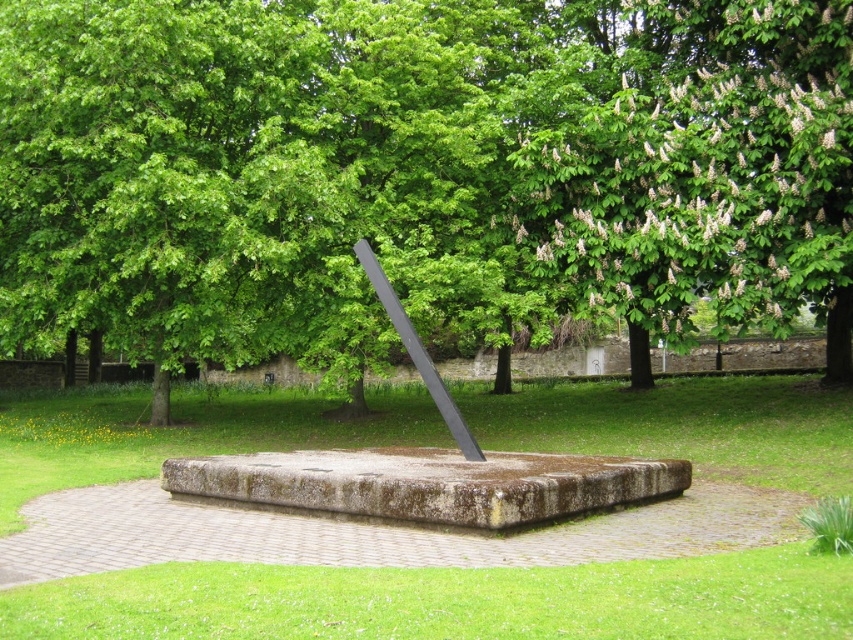
You are a landscape architect assessing the visibility of the black polished metal rod at center from the curved brick pathway. Considering the green leafy tree at center, will the tree block the view of the rod from the pathway?

The black polished metal rod at center is behind the green leafy tree at center, so the tree will block the view of the rod from the pathway.

You are a landscape architect planning to install a new bench in the park. You want to place it where it can be seen from both the green leafy tree at center and the green leafy tree at upper right. Based on their heights, which tree would provide a better vantage point for visibility?

The green leafy tree at center is taller than the green leafy tree at upper right, so placing the bench near the green leafy tree at center would provide a better vantage point for visibility as its height offers a wider view.